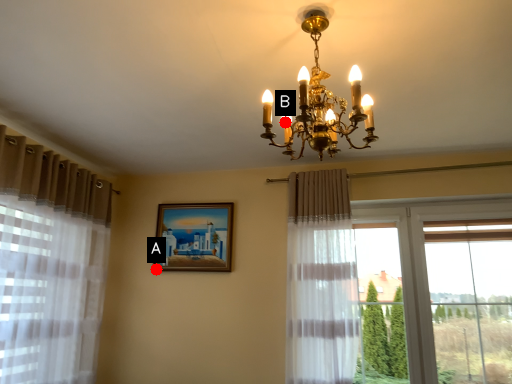
Question: Two points are circled on the image, labeled by A and B beside each circle. Which point appears farthest from the camera in this image?

Choices:
 (A) A is further
 (B) B is further

Answer: (A)